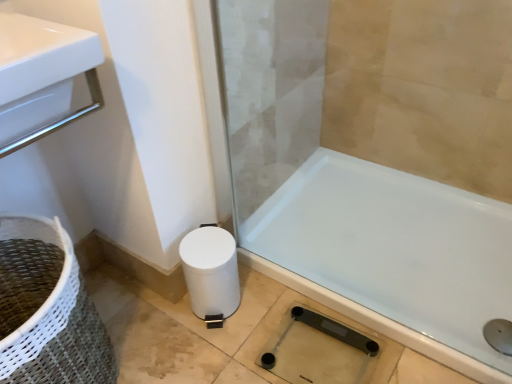
You are a GUI agent. You are given a task and a screenshot of the screen. Output one action in this format:
    pyautogui.click(x=<x>, y=<y>)
    Task: Click on the vacant space situated above white matte toilet paper at lower left (from a real-world perspective)
    This screenshot has height=384, width=512.
    Given the screenshot: What is the action you would take?
    pyautogui.click(x=204, y=250)